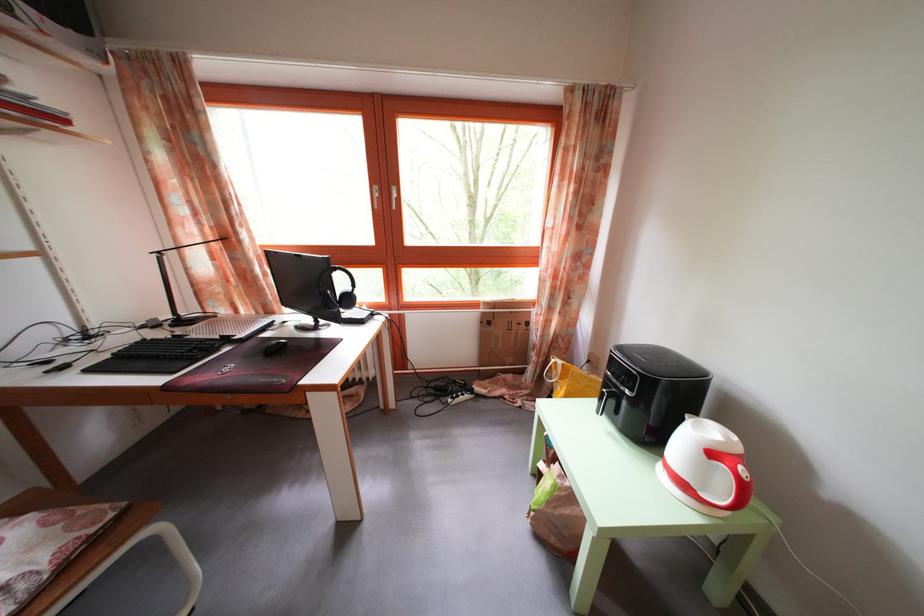
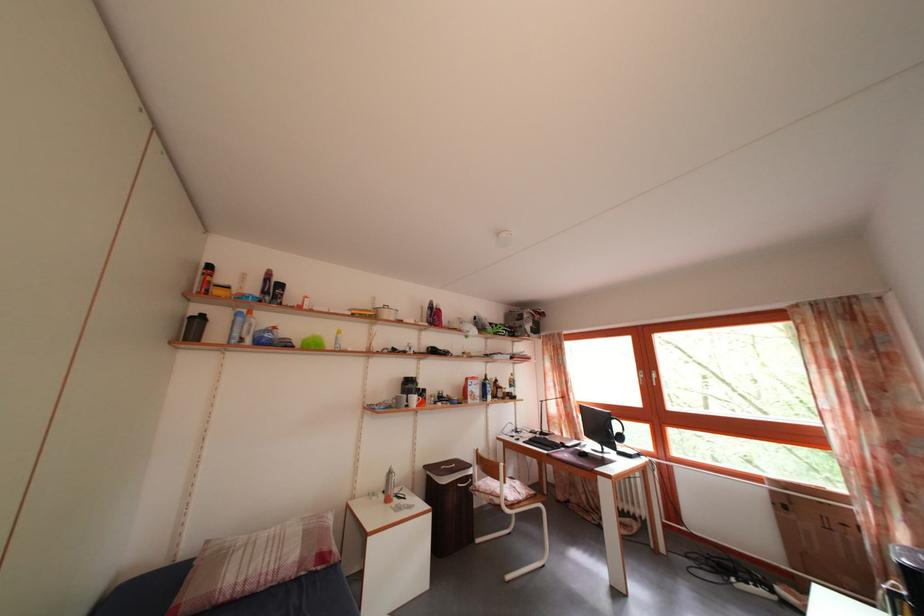
In the second image, find the point that corresponds to the point at 348,290 in the first image.

(624, 434)